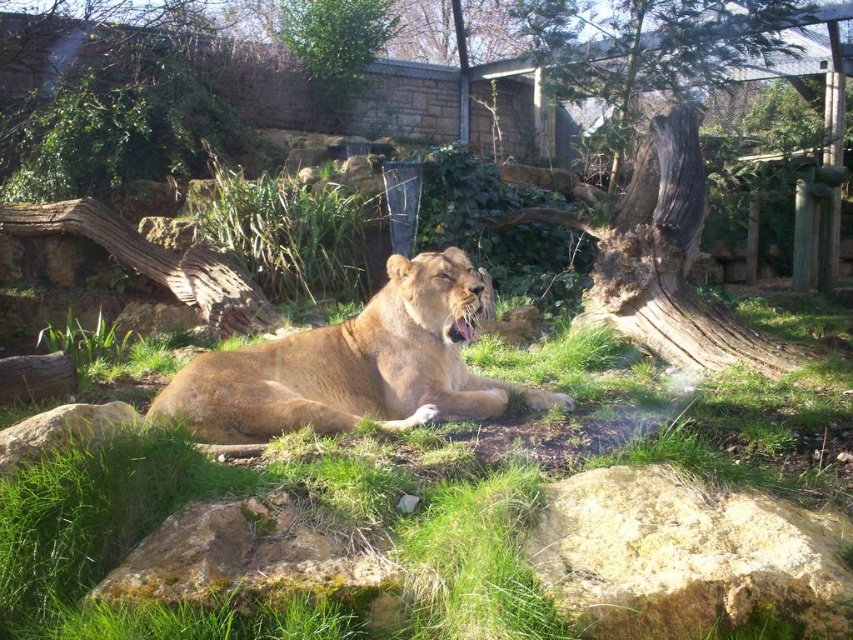
You are a zookeeper who needs to place a new feeding tray for the lion. The tray is 1.5 meters wide. Can you place it between the yellowish rock at lower right and the golden fur lion at center without moving either object?

The distance between the yellowish rock at lower right and the golden fur lion at center is 1.61 meters. Since the feeding tray is 1.5 meters wide, it can fit between them as the space available is slightly larger than the tray.